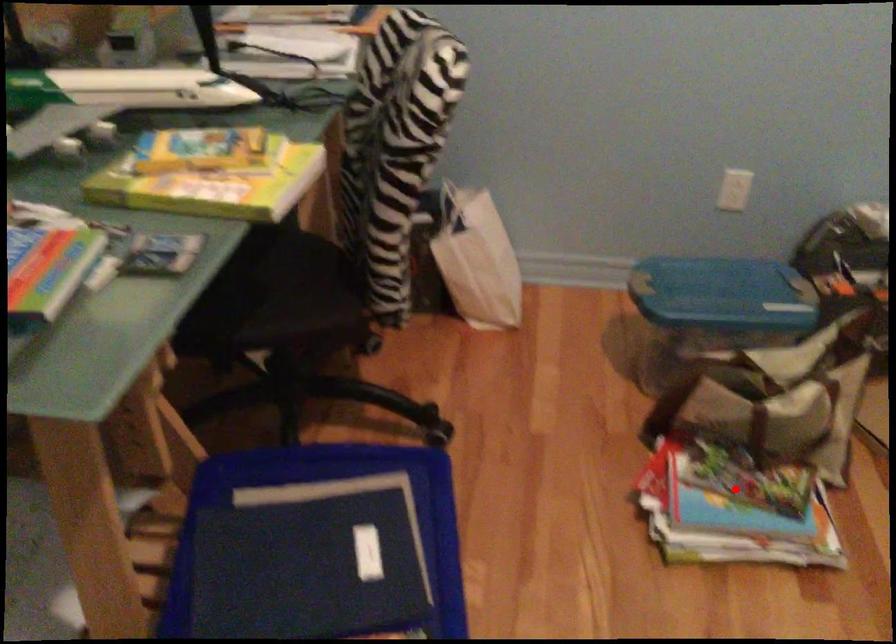
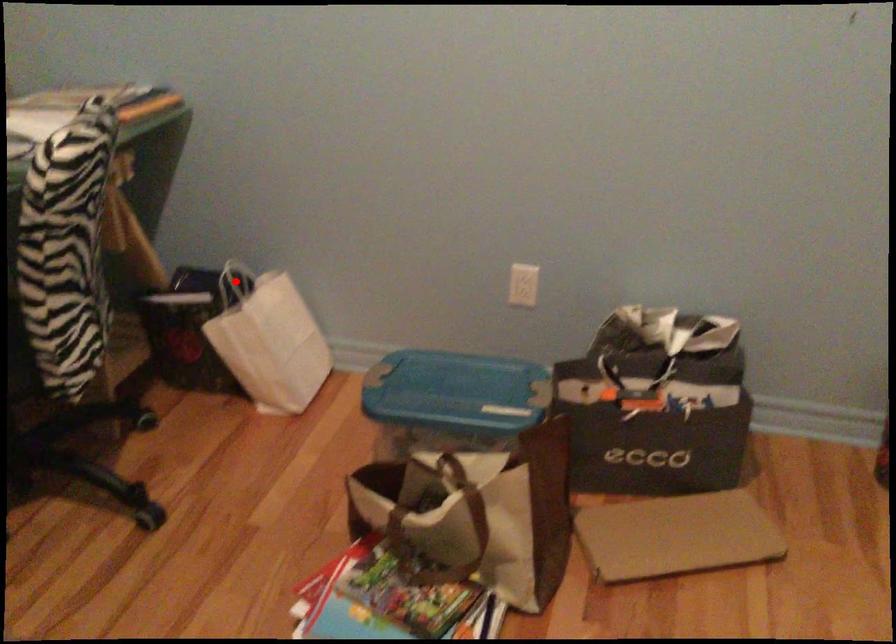
I am providing you with two images of the same scene from different viewpoints. A red point is marked on the first image and another point is marked on the second image. Do the highlighted points in image1 and image2 indicate the same real-world spot?

No